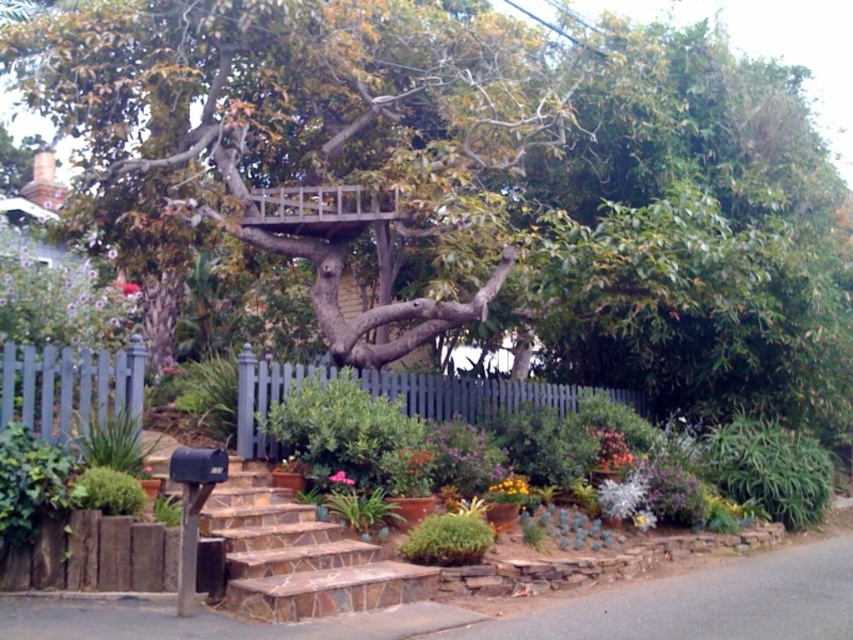
You are a gardener planning to add a new flower bed between the brown stone stairs at center and the purple matte flower at upper left. Which area has more space available for planting?

The purple matte flower at upper left has more space available for planting because the brown stone stairs at center occupies less space than it.

You are standing in the garden and see both the yellow matte flower at center and the pink matte flower at center. Which flower is positioned to the right when facing the garden?

The yellow matte flower at center is positioned to the right of the pink matte flower at center.

Consider the image. You are a gardener who wants to plant a new flower that needs to be placed below the purple matte flower at upper left and above the yellow matte flower at center. Can you determine if there is enough vertical space between them for the new flower?

The purple matte flower at upper left is taller than the yellow matte flower at center, so there is enough vertical space between them to plant the new flower.